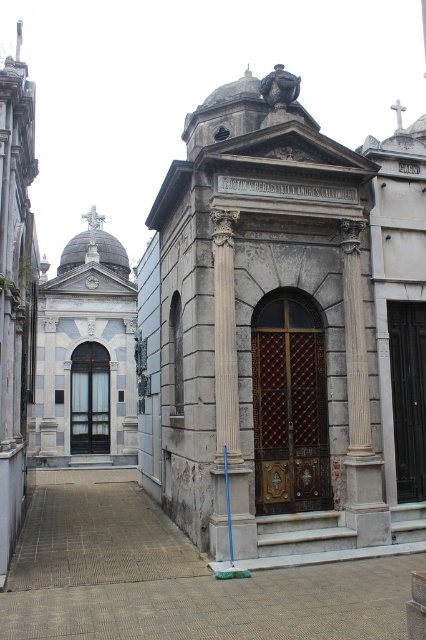
You are standing at the entrance of the cemetery and want to find the white marble church at center. Which direction should you walk to reach it?

The white marble church at center is located at coordinates (86, 355), so you should walk towards the center of the cemetery to reach it.